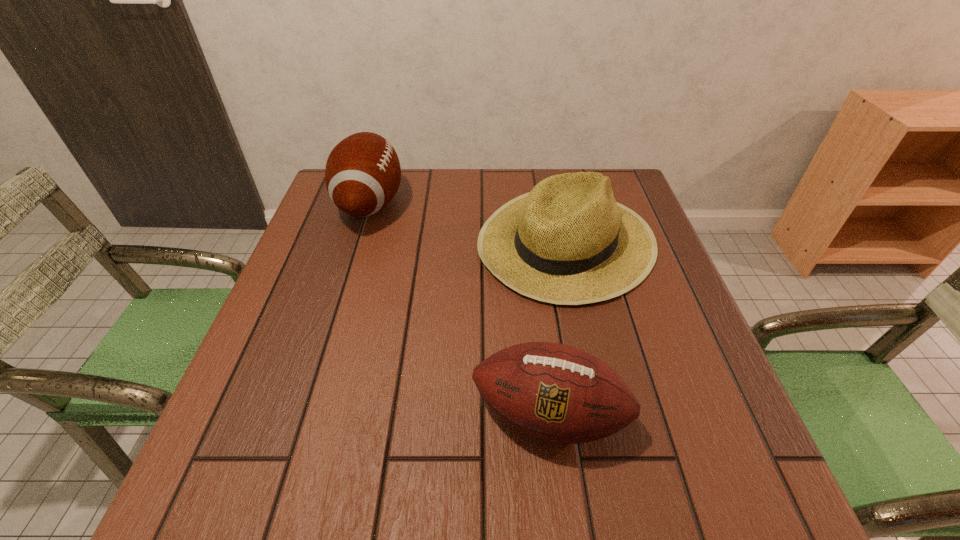
Where is `object located at the near edge`? object located at the near edge is located at coordinates (554, 392).

Locate an element on the screen. This screenshot has width=960, height=540. object that is at the left edge is located at coordinates (362, 175).

Find the location of a particular element. object that is at the right edge is located at coordinates (568, 242).

Find the location of a particular element. The image size is (960, 540). object at the far left corner is located at coordinates (362, 175).

You are a GUI agent. You are given a task and a screenshot of the screen. Output one action in this format:
    pyautogui.click(x=<x>, y=<y>)
    Task: Click on the object that is at the far right corner
    
    Given the screenshot: What is the action you would take?
    pyautogui.click(x=568, y=242)

Where is `free region at the far edge`? free region at the far edge is located at coordinates click(x=480, y=183).

Locate an element on the screen. The width and height of the screenshot is (960, 540). vacant point at the near edge is located at coordinates (x=608, y=456).

Locate an element on the screen. The height and width of the screenshot is (540, 960). free space at the left edge is located at coordinates (332, 306).

Find the location of a particular element. vacant region at the right edge of the desktop is located at coordinates (668, 407).

I want to click on free region at the near left corner of the desktop, so click(x=238, y=461).